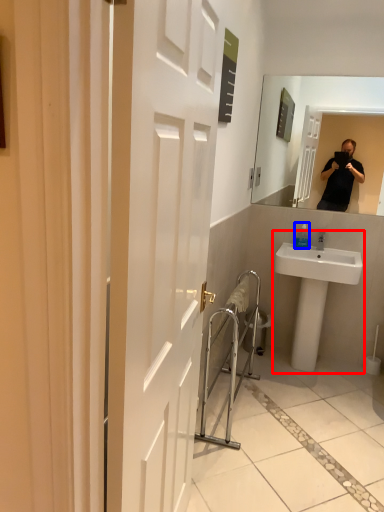
Question: Which of the following is the closest to the observer, sink (highlighted by a red box) or bottle (highlighted by a blue box)?

Choices:
 (A) sink
 (B) bottle

Answer: (A)